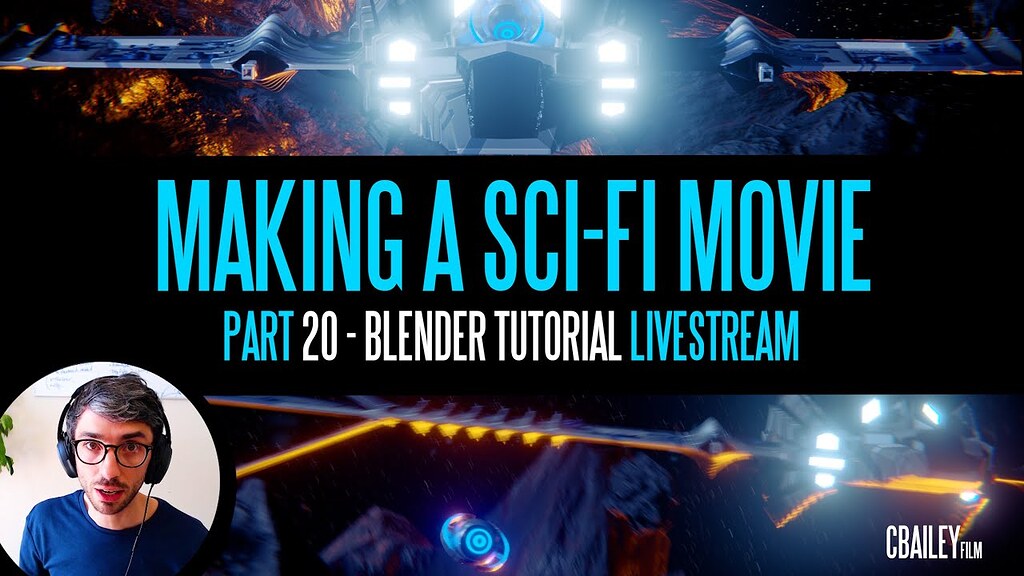
Find the location of a particular element. black cable is located at coordinates (x=137, y=530).